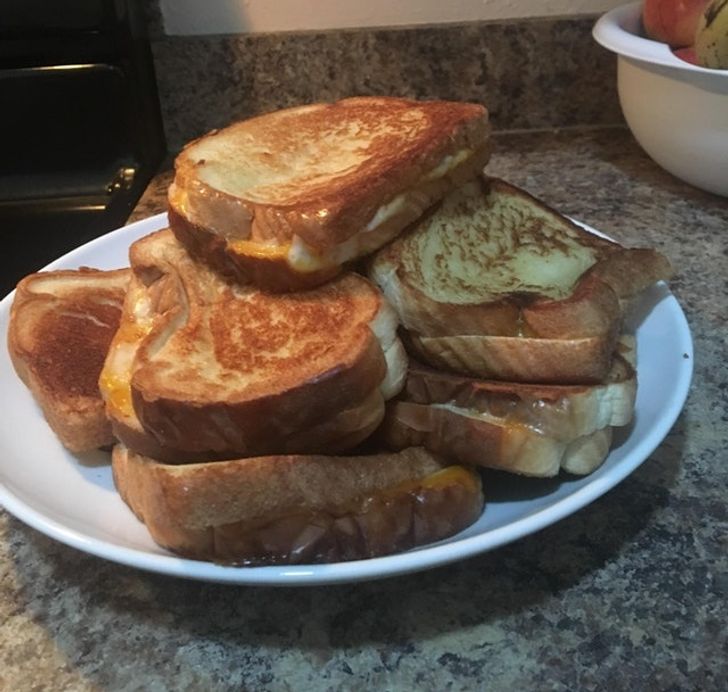
The width and height of the screenshot is (728, 692). I want to click on backsplash, so click(x=427, y=55).